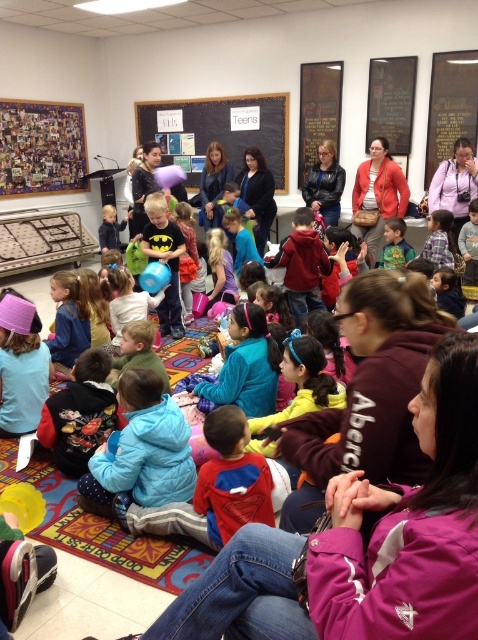
Question: From the image, what is the correct spatial relationship of black chalkboard at upper center in relation to purple fabric headband at upper left?

Choices:
 (A) below
 (B) above

Answer: (B)

Question: Among these objects, which one is farthest from the camera?

Choices:
 (A) blue fleece jacket at lower left
 (B) matte black batman shirt at center
 (C) matte red jacket at upper right
 (D) purple fabric headband at upper left

Answer: (C)

Question: Can you confirm if purple fabric headband at upper left is positioned to the left of matte red jacket at upper right?

Choices:
 (A) yes
 (B) no

Answer: (A)

Question: Considering the real-world distances, which object is farthest from the matte black batman shirt at center?

Choices:
 (A) purple fabric headband at upper left
 (B) black chalkboard at upper center
 (C) matte red jacket at upper right

Answer: (B)

Question: Estimate the real-world distances between objects in this image. Which object is farther from the matte black batman shirt at center?

Choices:
 (A) purple fabric headband at upper left
 (B) black chalkboard at upper center
 (C) blue fleece jacket at lower center
 (D) matte red jacket at upper right

Answer: (B)

Question: Is blue fleece jacket at lower center positioned before black chalkboard at upper center?

Choices:
 (A) no
 (B) yes

Answer: (B)